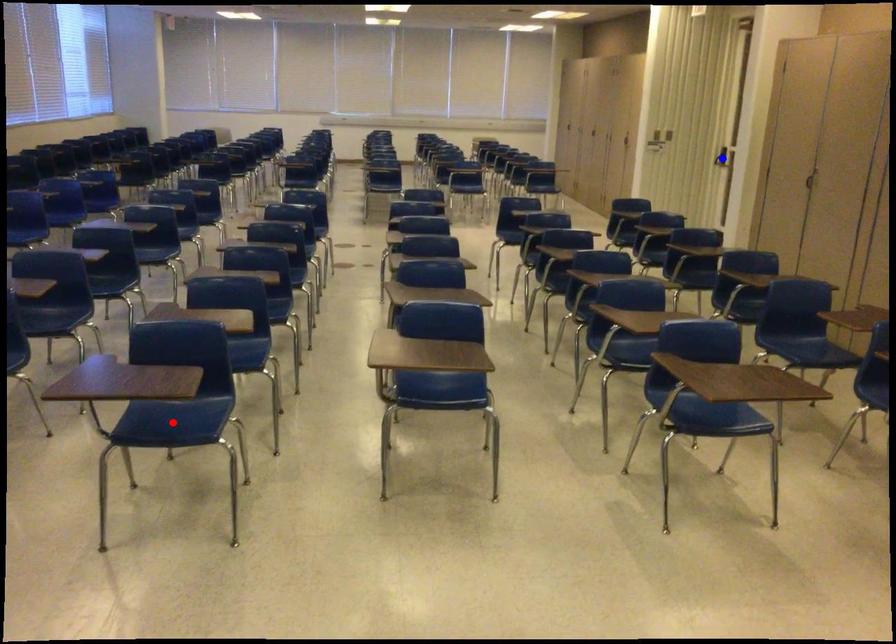
Question: Which of the two points in the image is closer to the camera?

Choices:
 (A) Blue point is closer.
 (B) Red point is closer.

Answer: (B)